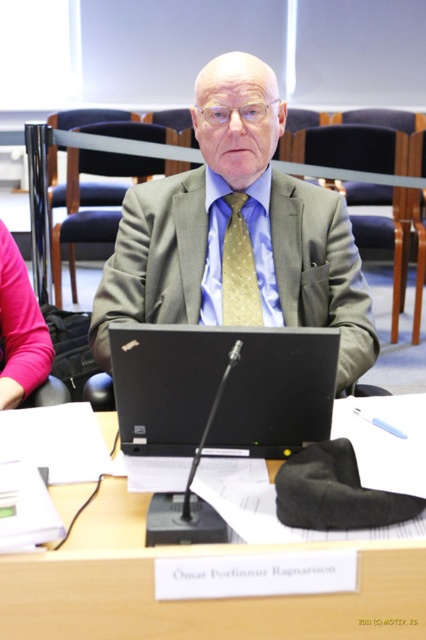
You are organizing a formal event and need to ensure that the gold dotted fabric tie at center can be placed on the wooden table at center without overlapping any other items. Based on their sizes, is this possible?

The wooden table at center is wider than the gold dotted fabric tie at center, so there should be enough space to place the gold dotted fabric tie at center without overlapping other items.

You are a photographer setting up for a formal event. You need to position a camera so that both the wooden table at center and the gold dotted fabric tie at center are visible in the frame. Based on their positions, which object should appear closer to the camera?

The wooden table at center is in front of the gold dotted fabric tie at center, so the wooden table at center will appear closer to the camera.